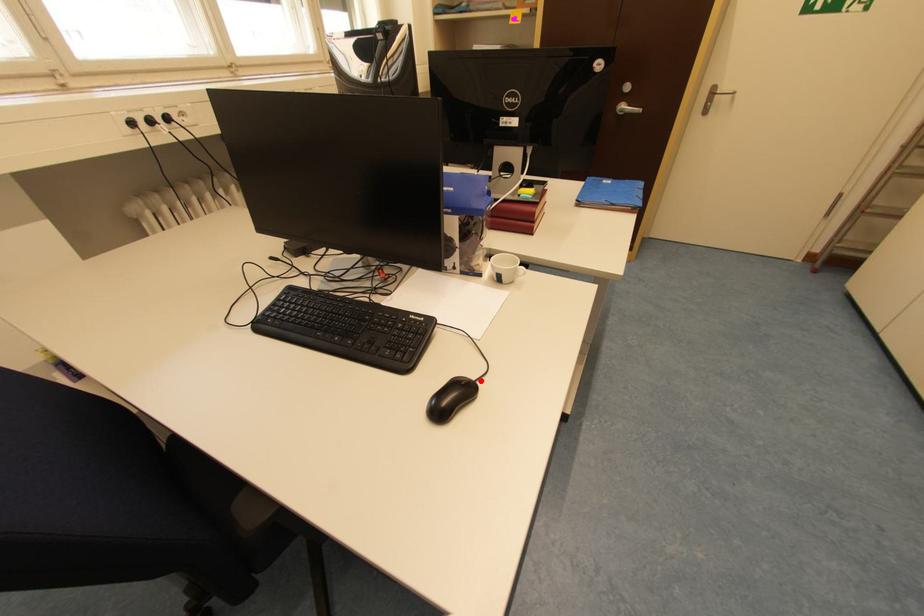
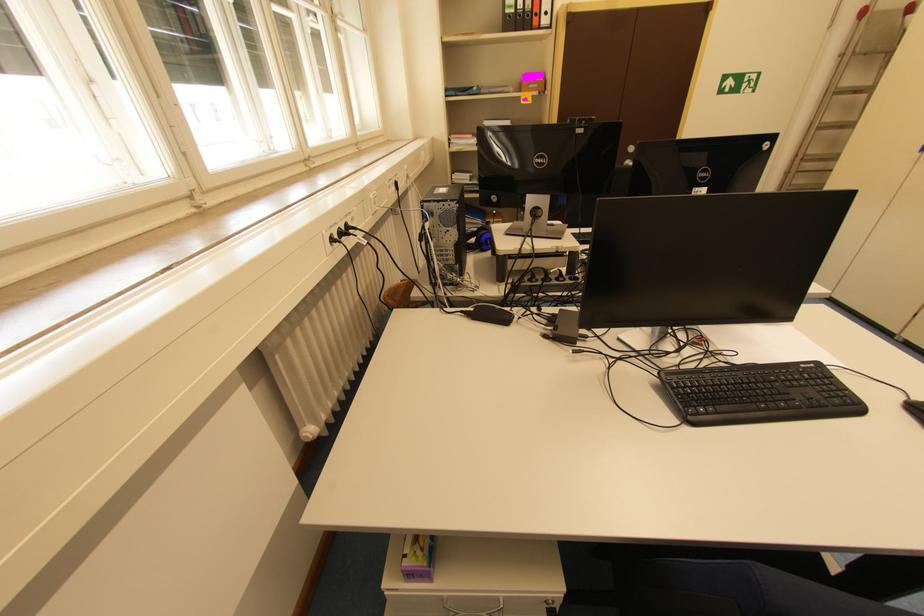
Question: I am providing you with two images of the same scene from different viewpoints. A red point is shown in image1. For the corresponding object point in image2, is it positioned nearer or farther from the camera?

Choices:
 (A) Nearer
 (B) Farther

Answer: (A)